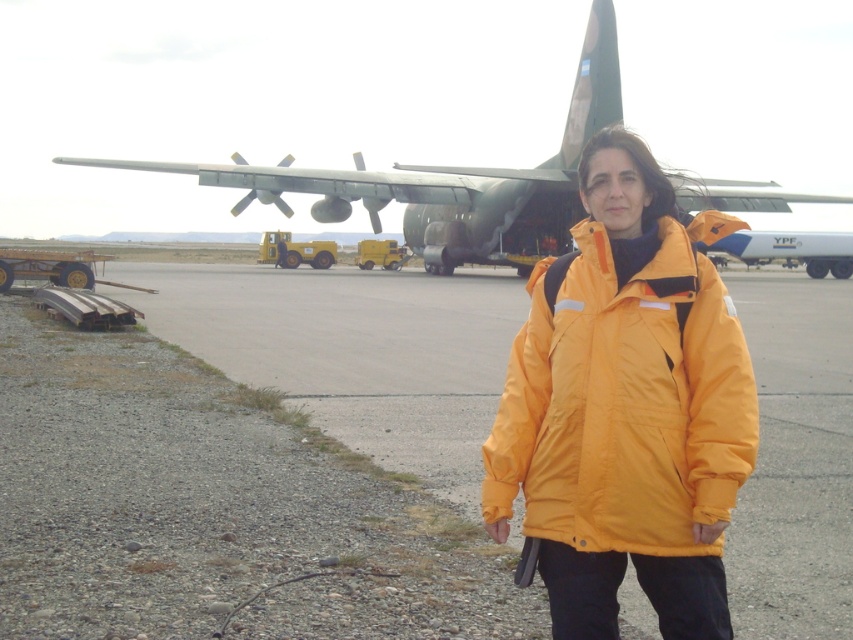
In the scene shown: You are a pilot who just landed your plane and need to retrieve your jacket. Your plane is the green matte airplane at upper center. Where should you look for your yellow matte jacket at center?

The yellow matte jacket at center is located to the left of the green matte airplane at upper center, so you should look to the left side of your plane.

You are a delivery person who needs to place a heavy crate on the ground. You see the smooth asphalt tarmac at center and the yellow matte jacket at center. Which surface is suitable for placing the heavy crate without damaging the surface?

The smooth asphalt tarmac at center is suitable for placing the heavy crate because it is located above the yellow matte jacket at center, making it a more stable and durable surface for heavy items.

You are standing at the point labeled point (381, 360) and want to walk towards the point labeled point (339, 212). Which direction should you face to move directly towards it?

Since point (381, 360) is closer to the viewer than point (339, 212), you should face away from the viewer to move directly towards point (339, 212).